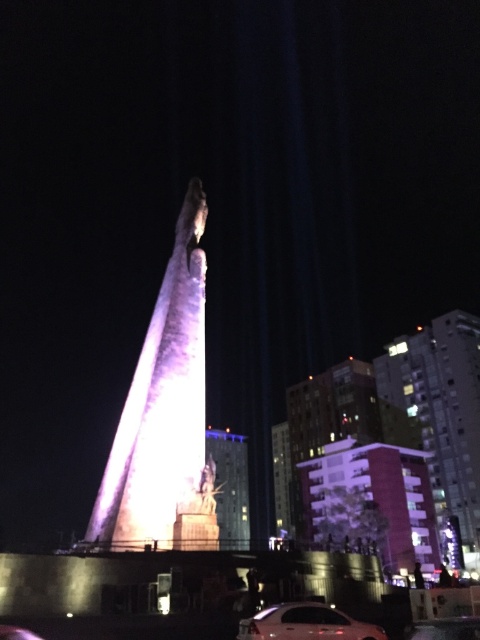
You are driving a car and want to park your shiny silver sedan at center near the shiny metallic statue at center. Based on their sizes, which one takes up more space in the parking area?

The shiny metallic statue at center takes up more space in the parking area because it is larger than the shiny silver sedan at center.

You are standing in the square and want to take a photo of the illuminated stone tower at center and the pink concrete building at right. Which object will appear larger in the photo?

The illuminated stone tower at center will appear larger in the photo because it is closer to the viewer than the pink concrete building at right.

In the scene shown: You are an architect analyzing the cityscape. Which structure is taller between the illuminated stone tower at center and the pink concrete building at right?

The pink concrete building at right is taller than the illuminated stone tower at center.